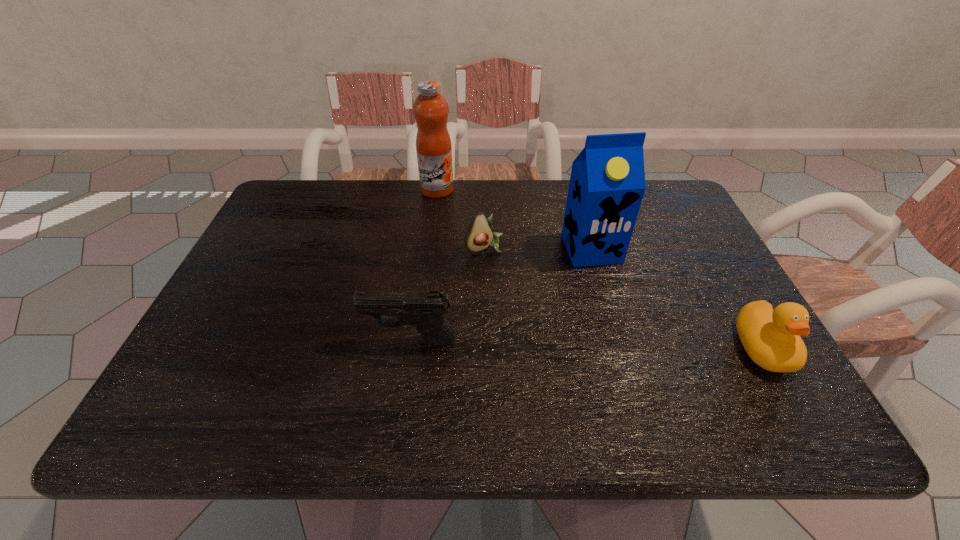
Where is `free spot on the desktop that is between the pistol and the rightmost object and is positioned on the front label of the fruit juice`? free spot on the desktop that is between the pistol and the rightmost object and is positioned on the front label of the fruit juice is located at coordinates (540, 343).

Where is `free space on the desktop that is between the pistol and the duck and is positioned with the cap open on the second object from right to left`? This screenshot has width=960, height=540. free space on the desktop that is between the pistol and the duck and is positioned with the cap open on the second object from right to left is located at coordinates (636, 345).

You are a GUI agent. You are given a task and a screenshot of the screen. Output one action in this format:
    pyautogui.click(x=<x>, y=<y>)
    Task: Click on the vacant space on the desktop that is between the pistol and the rightmost object and is positioned on the seed side of the third object from right to left
    The image size is (960, 540).
    Given the screenshot: What is the action you would take?
    pyautogui.click(x=553, y=343)